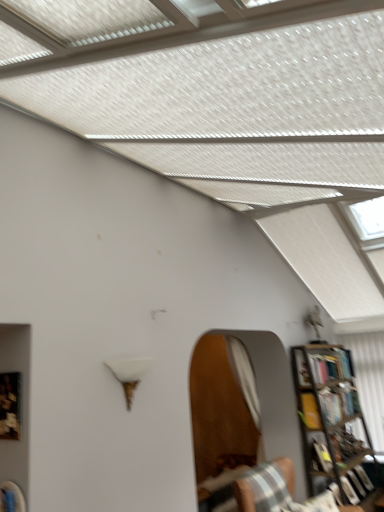
Find the location of a particular element. hardcover book at right is located at coordinates (338, 402).

In order to click on metallic bookcase at right in this screenshot , I will do `click(331, 420)`.

This screenshot has width=384, height=512. In order to click on white fabric curtain at right in this screenshot , I will do `click(369, 379)`.

Which object is further away from the camera, striped fabric chair at lower right or hardcover book at right?

hardcover book at right is further away from the camera.

Is striped fabric chair at lower right outside of hardcover book at right?

Yes, striped fabric chair at lower right is not within hardcover book at right.

From the picture: Is striped fabric chair at lower right to the right of hardcover book at right from the viewer's perspective?

No.

From the image's perspective, relative to hardcover book at right, is striped fabric chair at lower right above or below?

From the image's perspective, striped fabric chair at lower right appears below hardcover book at right.

The width and height of the screenshot is (384, 512). In order to click on curtain above the metallic bookcase at right (from the image's perspective) in this screenshot , I will do `click(369, 379)`.

In the scene shown: Considering the positions of objects metallic bookcase at right and white fabric curtain at right in the image provided, who is more to the right, metallic bookcase at right or white fabric curtain at right?

white fabric curtain at right.

From a real-world perspective, between metallic bookcase at right and white fabric curtain at right, who is vertically higher?

white fabric curtain at right is physically above.

Is point (334, 438) closer or farther from the camera than point (369, 372)?

Clearly, point (334, 438) is closer to the camera than point (369, 372).

Which object is positioned more to the right, white fabric curtain at right or hardcover book at right?

white fabric curtain at right is more to the right.

Is white fabric curtain at right oriented towards hardcover book at right?

Yes, white fabric curtain at right is aimed at hardcover book at right.

From the image's perspective, which one is positioned lower, white fabric curtain at right or hardcover book at right?

From the image's view, white fabric curtain at right is below.

Is white fabric curtain at right surrounding hardcover book at right?

No, hardcover book at right is located outside of white fabric curtain at right.

What are the coordinates of `book that is above the metallic bookcase at right (from a real-world perspective)` in the screenshot? It's located at (338, 402).

Can we say hardcover book at right lies outside metallic bookcase at right?

No, hardcover book at right is inside or overlapping with metallic bookcase at right.

Considering the relative sizes of hardcover book at right and metallic bookcase at right in the image provided, is hardcover book at right shorter than metallic bookcase at right?

Indeed, hardcover book at right has a lesser height compared to metallic bookcase at right.

Visually, is hardcover book at right positioned to the left or to the right of metallic bookcase at right?

hardcover book at right is positioned on metallic bookcase at right's right side.

Is point (383, 430) closer or farther from the camera than point (322, 463)?

Point (383, 430) is positioned farther from the camera compared to point (322, 463).

Considering the sizes of white fabric curtain at right and metallic bookcase at right in the image, is white fabric curtain at right bigger or smaller than metallic bookcase at right?

Clearly, white fabric curtain at right is smaller in size than metallic bookcase at right.

Considering the sizes of objects white fabric curtain at right and metallic bookcase at right in the image provided, who is taller, white fabric curtain at right or metallic bookcase at right?

With more height is metallic bookcase at right.

Considering the relative sizes of white fabric curtain at right and metallic bookcase at right in the image provided, is white fabric curtain at right thinner than metallic bookcase at right?

Indeed, white fabric curtain at right has a lesser width compared to metallic bookcase at right.

Does metallic bookcase at right come in front of hardcover book at right?

Yes, metallic bookcase at right is in front of hardcover book at right.

From the image's perspective, would you say metallic bookcase at right is shown under hardcover book at right?

Correct, metallic bookcase at right appears lower than hardcover book at right in the image.

Which object is positioned more to the left, metallic bookcase at right or hardcover book at right?

metallic bookcase at right is more to the left.

From a real-world perspective, is metallic bookcase at right positioned under hardcover book at right based on gravity?

Correct, in the physical world, metallic bookcase at right is lower than hardcover book at right.

Which is in front, point (360, 352) or point (234, 493)?

The point (234, 493) is closer to the camera.

Which is more to the right, white fabric curtain at right or striped fabric chair at lower right?

Positioned to the right is white fabric curtain at right.

Looking at this image, from their relative heights in the image, would you say white fabric curtain at right is taller or shorter than striped fabric chair at lower right?

In the image, white fabric curtain at right appears to be taller than striped fabric chair at lower right.

From the image's perspective, is white fabric curtain at right above striped fabric chair at lower right?

Yes, from the image's perspective, white fabric curtain at right is on top of striped fabric chair at lower right.

Locate an element on the screen. furniture directly beneath the hardcover book at right (from a real-world perspective) is located at coordinates (266, 487).

I want to click on bookcase on the left of white fabric curtain at right, so click(331, 420).

Considering their positions, is striped fabric chair at lower right positioned further to white fabric curtain at right than hardcover book at right?

The object further to white fabric curtain at right is striped fabric chair at lower right.

Looking at the image, which one is located closer to metallic bookcase at right, striped fabric chair at lower right or hardcover book at right?

hardcover book at right is closer to metallic bookcase at right.

From the image, which object appears to be farther from white fabric curtain at right, metallic bookcase at right or hardcover book at right?

Based on the image, metallic bookcase at right appears to be further to white fabric curtain at right.

When comparing their distances from metallic bookcase at right, does hardcover book at right or white fabric curtain at right seem further?

white fabric curtain at right is positioned further to the anchor metallic bookcase at right.

When comparing their distances from white fabric curtain at right, does metallic bookcase at right or striped fabric chair at lower right seem closer?

metallic bookcase at right.

Considering their positions, is metallic bookcase at right positioned further to hardcover book at right than striped fabric chair at lower right?

Among the two, striped fabric chair at lower right is located further to hardcover book at right.

Looking at the image, which one is located closer to white fabric curtain at right, striped fabric chair at lower right or metallic bookcase at right?

metallic bookcase at right lies closer to white fabric curtain at right than the other object.

Looking at the image, which one is located closer to white fabric curtain at right, hardcover book at right or metallic bookcase at right?

hardcover book at right is closer to white fabric curtain at right.

Where is `book between striped fabric chair at lower right and white fabric curtain at right in the front-back direction`? The width and height of the screenshot is (384, 512). book between striped fabric chair at lower right and white fabric curtain at right in the front-back direction is located at coordinates (338, 402).

Identify the location of bookcase between striped fabric chair at lower right and white fabric curtain at right along the z-axis. This screenshot has height=512, width=384. (331, 420).

Where is `book between metallic bookcase at right and white fabric curtain at right from front to back`? Image resolution: width=384 pixels, height=512 pixels. book between metallic bookcase at right and white fabric curtain at right from front to back is located at coordinates (338, 402).

At what (x,y) coordinates should I click in order to perform the action: click on bookcase between striped fabric chair at lower right and hardcover book at right along the z-axis. Please return your answer as a coordinate pair (x, y). The width and height of the screenshot is (384, 512). Looking at the image, I should click on (331, 420).